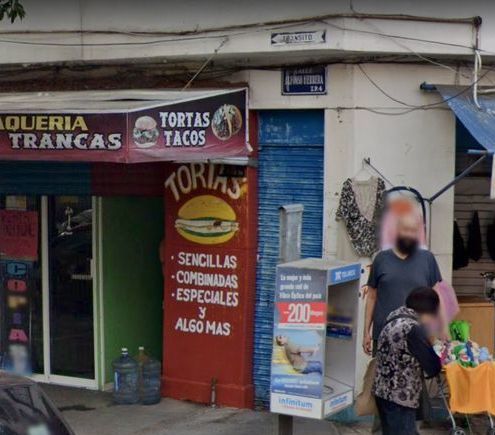
The width and height of the screenshot is (495, 435). What are the coordinates of `green wall` in the screenshot? It's located at (118, 287).